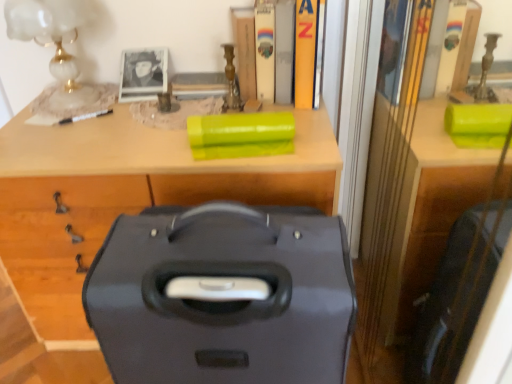
This screenshot has height=384, width=512. I want to click on vacant space situated above matte black suitcase at center (from a real-world perspective), so click(x=134, y=122).